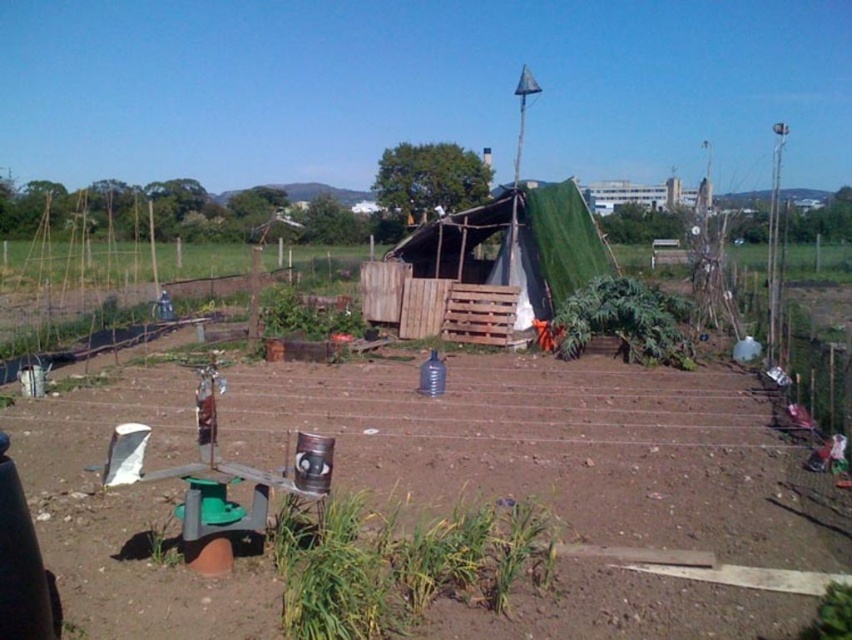
Can you confirm if brown soil at center is thinner than green tarpaulin tent at center?

No, brown soil at center is not thinner than green tarpaulin tent at center.

Is brown soil at center positioned in front of green tarpaulin tent at center?

Yes, it is.

Between point (447, 435) and point (496, 342), which one is positioned behind?

Point (496, 342)

What are the coordinates of `brown soil at center` in the screenshot? It's located at (548, 448).